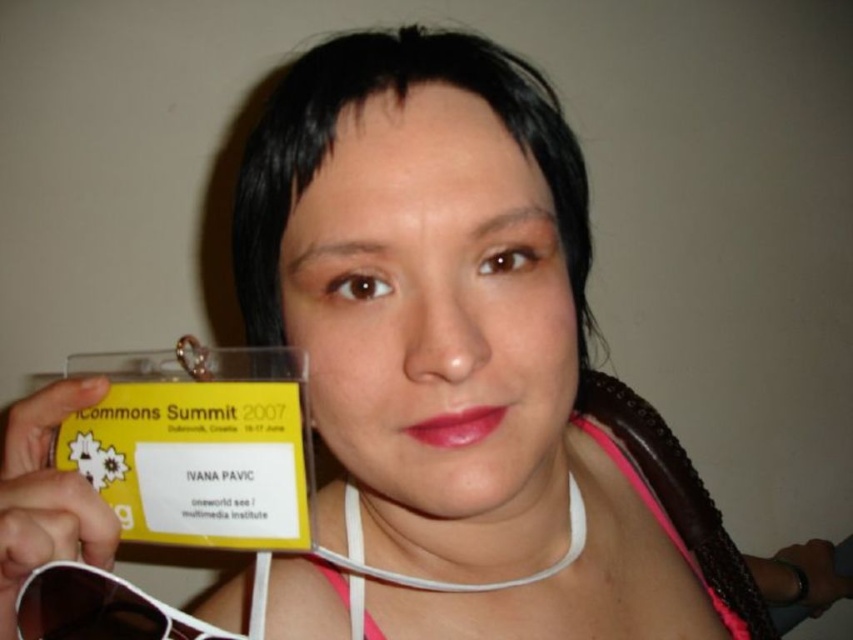
Question: Can you confirm if black plastic sunglasses at lower left is positioned below pink fabric bikini top at lower center?

Choices:
 (A) no
 (B) yes

Answer: (B)

Question: Does black plastic sunglasses at lower left come in front of pink fabric bikini top at lower center?

Choices:
 (A) yes
 (B) no

Answer: (A)

Question: Among these points, which one is nearest to the camera?

Choices:
 (A) (666, 534)
 (B) (102, 632)

Answer: (B)

Question: Where is black plastic sunglasses at lower left located in relation to pink fabric bikini top at lower center in the image?

Choices:
 (A) right
 (B) left

Answer: (B)

Question: Which point is farther from the camera taking this photo?

Choices:
 (A) (103, 612)
 (B) (583, 545)

Answer: (B)